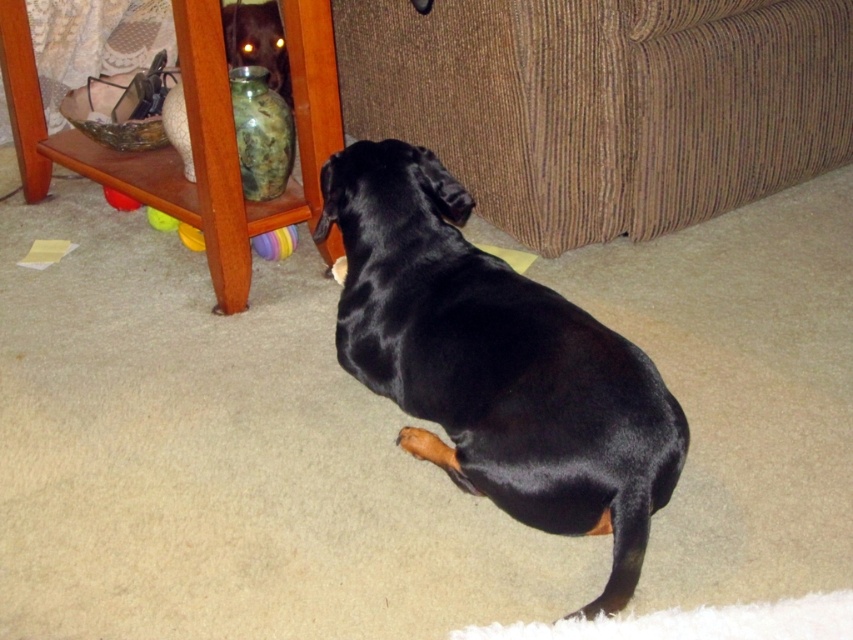
At what (x,y) coordinates should I click in order to perform the action: click on multicolored rubber ball at lower center. Please return your answer as a coordinate pair (x, y). This screenshot has height=640, width=853. Looking at the image, I should click on (276, 243).

Does yellow rubber toy at lower left lie behind yellow rubber ball at lower left?

No, it is not.

Can you confirm if yellow rubber toy at lower left is positioned below yellow rubber ball at lower left?

Correct, yellow rubber toy at lower left is located below yellow rubber ball at lower left.

This screenshot has height=640, width=853. I want to click on yellow rubber toy at lower left, so click(x=190, y=236).

Locate an element on the screen. multicolored rubber ball at lower center is located at coordinates (276, 243).

Describe the element at coordinates (276, 243) in the screenshot. I see `multicolored rubber ball at lower center` at that location.

Image resolution: width=853 pixels, height=640 pixels. I want to click on multicolored rubber ball at lower center, so click(276, 243).